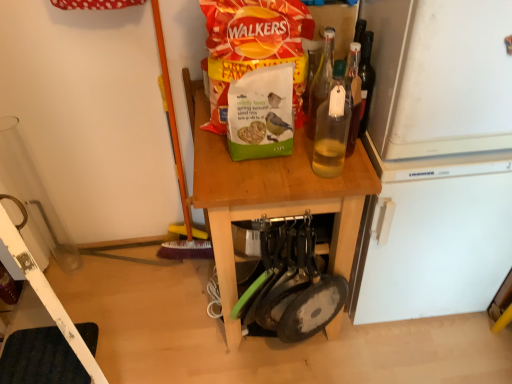
The width and height of the screenshot is (512, 384). I want to click on free location to the right of transparent glass bottle at center, which appears as the first bottle when viewed from the front, so click(358, 170).